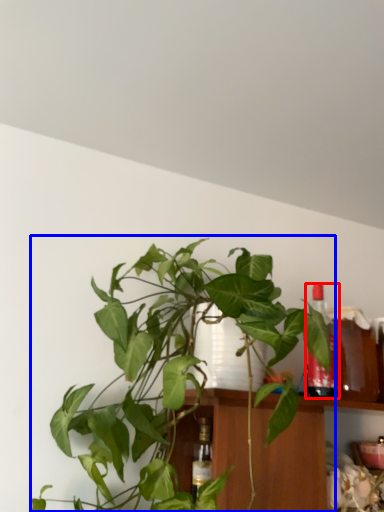
Question: Which object appears closest to the camera in this image, bottle (highlighted by a red box) or houseplant (highlighted by a blue box)?

Choices:
 (A) bottle
 (B) houseplant

Answer: (B)